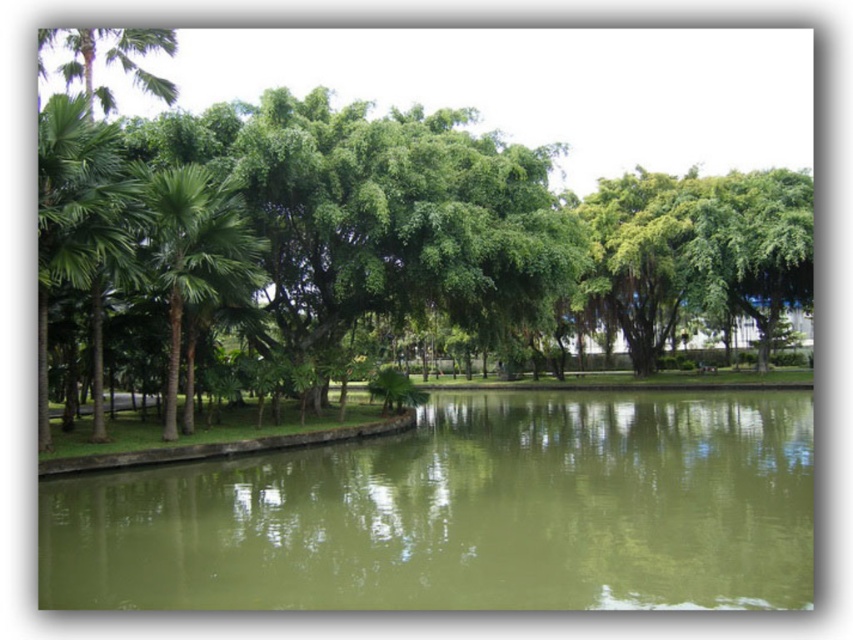
Question: Which point is farther from the camera taking this photo?

Choices:
 (A) (366, 538)
 (B) (225, 234)

Answer: (B)

Question: Which point is closer to the camera?

Choices:
 (A) (305, 566)
 (B) (178, 230)

Answer: (A)

Question: Can you confirm if green murky water at center is positioned to the left of green leafy palm tree at left?

Choices:
 (A) no
 (B) yes

Answer: (A)

Question: Does green murky water at center appear on the left side of green leafy palm tree at left?

Choices:
 (A) no
 (B) yes

Answer: (A)

Question: In this image, where is green murky water at center located relative to green leafy palm tree at left?

Choices:
 (A) left
 (B) right

Answer: (B)